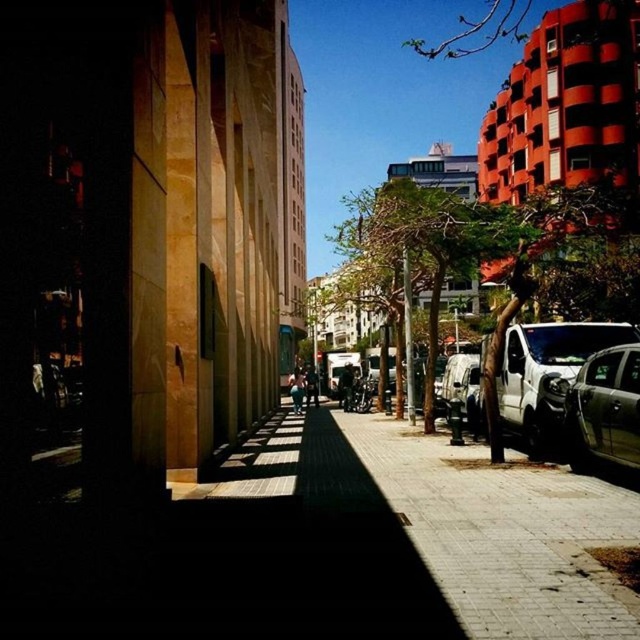
You are a delivery driver who needs to park your truck between the white matte van at right and the metallic silver suv at right. Given that your truck is 6 meters long, can you fit it there?

The white matte van at right is larger in size than the metallic silver suv at right, but the exact distance between them isn

You are a delivery driver who needs to park your vehicle in a space that can only accommodate vehicles smaller than the metallic silver van at center. You see the metallic silver suv at right. Can you park your vehicle there?

The metallic silver suv at right is smaller than the metallic silver van at center, so yes, you can park your vehicle there as it meets the size requirement.

You are standing at the entrance of the tall building with a textured facade on the left side of the street. You want to walk to the parked vehicles on the right side. According to the image, where exactly is the paved stone sidewalk at center located in terms of coordinates?

The paved stone sidewalk at center is located at coordinates point (408, 536).